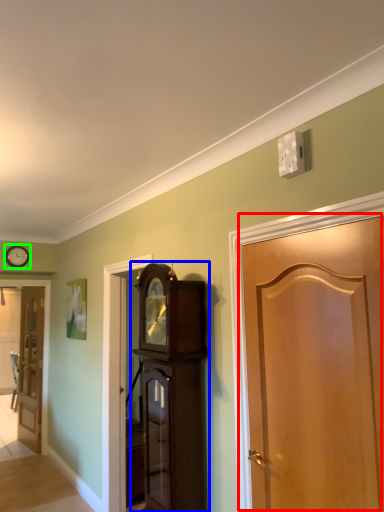
Question: Which object is positioned closest to door (highlighted by a red box)? Select from cabinetry (highlighted by a blue box) and clock (highlighted by a green box).

Choices:
 (A) cabinetry
 (B) clock

Answer: (A)